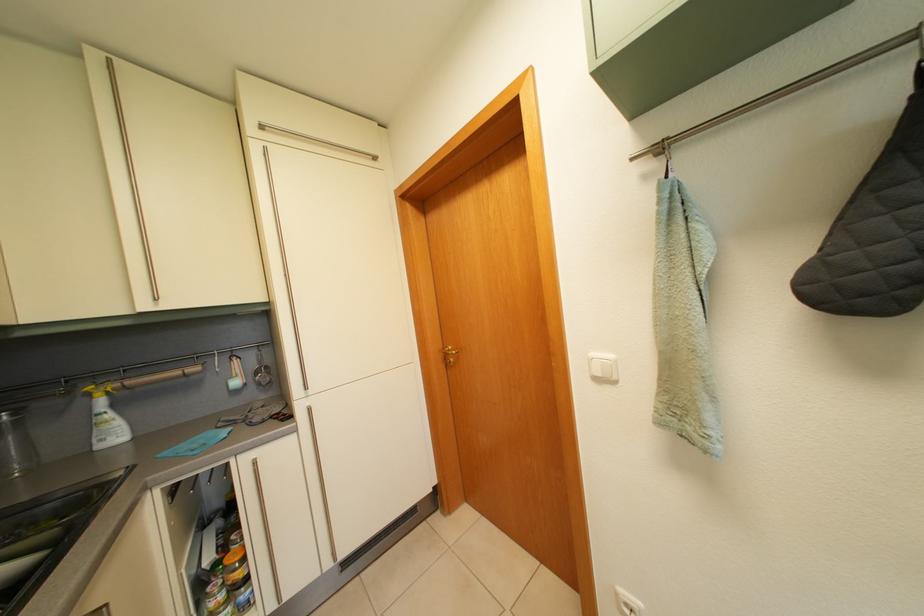
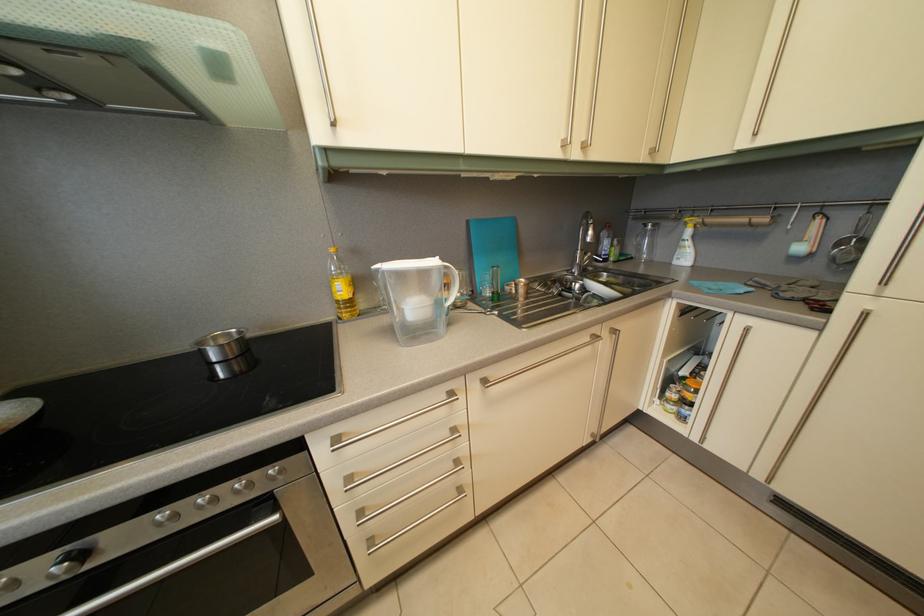
In the scene shown: First-person continuous shooting, in which direction is the camera rotating?

The rotation direction of the camera is left-down.